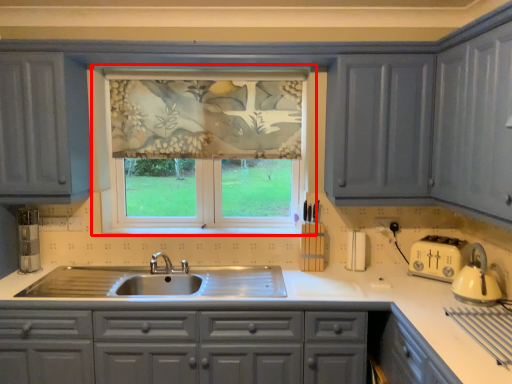
Question: Where is window (annotated by the red box) located in relation to countertop in the image?

Choices:
 (A) right
 (B) left

Answer: (A)